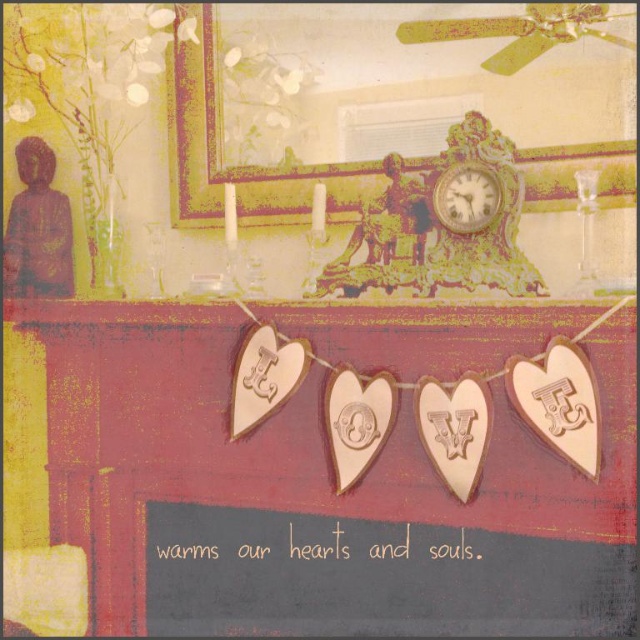
Who is positioned more to the right, metallic gold picture frame at upper center or gold textured clock at upper center?

From the viewer's perspective, gold textured clock at upper center appears more on the right side.

Is metallic gold picture frame at upper center closer to the viewer compared to gold textured clock at upper center?

No, metallic gold picture frame at upper center is behind gold textured clock at upper center.

Locate an element on the screen. The width and height of the screenshot is (640, 640). metallic gold picture frame at upper center is located at coordinates (392, 100).

Can you confirm if wooden hearts at center is bigger than gold textured clock at upper center?

Yes.

Is wooden hearts at center behind gold textured clock at upper center?

No.

What do you see at coordinates (336, 467) in the screenshot? I see `wooden hearts at center` at bounding box center [336, 467].

You are a GUI agent. You are given a task and a screenshot of the screen. Output one action in this format:
    pyautogui.click(x=<x>, y=<y>)
    Task: Click on the wooden hearts at center
    The image size is (640, 640).
    Given the screenshot: What is the action you would take?
    pyautogui.click(x=336, y=467)

Is wooden hearts at center wider than metallic gold picture frame at upper center?

Indeed, wooden hearts at center has a greater width compared to metallic gold picture frame at upper center.

Consider the image. Can you confirm if wooden hearts at center is bigger than metallic gold picture frame at upper center?

Correct, wooden hearts at center is larger in size than metallic gold picture frame at upper center.

Where is `wooden hearts at center`? wooden hearts at center is located at coordinates (336, 467).

Find the location of `wooden hearts at center`. wooden hearts at center is located at coordinates (336, 467).